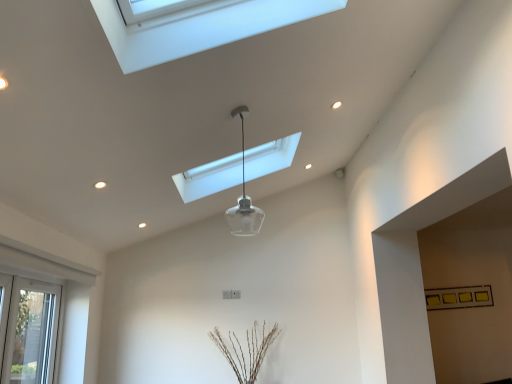
Question: Is transparent glass pendant light at center, the 1th lamp from the back, not close to white plastic window at lower left?

Choices:
 (A) no
 (B) yes

Answer: (B)

Question: Is transparent glass pendant light at center, the 1th lamp from the back, oriented away from white plastic window at lower left?

Choices:
 (A) yes
 (B) no

Answer: (B)

Question: From the image's perspective, would you say transparent glass pendant light at center, acting as the 2th lamp starting from the front, is shown under white plastic window at lower left?

Choices:
 (A) yes
 (B) no

Answer: (B)

Question: Can you confirm if transparent glass pendant light at center, acting as the 2th lamp starting from the front, is thinner than white plastic window at lower left?

Choices:
 (A) no
 (B) yes

Answer: (A)

Question: Is transparent glass pendant light at center, acting as the 2th lamp starting from the front, at the left side of white plastic window at lower left?

Choices:
 (A) no
 (B) yes

Answer: (A)

Question: Considering their positions, is transparent glass pendant light at center, the 1th lamp from the back, located in front of or behind transparent glass pendant light at center, the 2th lamp viewed from the back?

Choices:
 (A) behind
 (B) front

Answer: (A)

Question: Based on their sizes in the image, would you say transparent glass pendant light at center, the 1th lamp from the back, is bigger or smaller than transparent glass pendant light at center, the 2th lamp viewed from the back?

Choices:
 (A) big
 (B) small

Answer: (A)

Question: From the image's perspective, is transparent glass pendant light at center, the 1th lamp from the back, above or below transparent glass pendant light at center, the first lamp positioned from the front?

Choices:
 (A) above
 (B) below

Answer: (A)

Question: From a real-world perspective, relative to transparent glass pendant light at center, the first lamp positioned from the front, is transparent glass pendant light at center, acting as the 2th lamp starting from the front, vertically above or below?

Choices:
 (A) below
 (B) above

Answer: (B)

Question: From the image's perspective, is white plastic window at lower left above or below transparent glass pendant light at center, the first lamp positioned from the front?

Choices:
 (A) below
 (B) above

Answer: (A)

Question: From a real-world perspective, relative to transparent glass pendant light at center, the 2th lamp viewed from the back, is white plastic window at lower left vertically above or below?

Choices:
 (A) below
 (B) above

Answer: (A)

Question: Is point (50, 302) closer or farther from the camera than point (259, 211)?

Choices:
 (A) closer
 (B) farther

Answer: (B)

Question: In terms of height, does white plastic window at lower left look taller or shorter compared to transparent glass pendant light at center, the first lamp positioned from the front?

Choices:
 (A) tall
 (B) short

Answer: (A)

Question: Based on their sizes in the image, would you say transparent glass pendant light at center, the first lamp positioned from the front, is bigger or smaller than white plastic window at lower left?

Choices:
 (A) small
 (B) big

Answer: (A)

Question: Considering the positions of transparent glass pendant light at center, the first lamp positioned from the front, and white plastic window at lower left in the image, is transparent glass pendant light at center, the first lamp positioned from the front, taller or shorter than white plastic window at lower left?

Choices:
 (A) short
 (B) tall

Answer: (A)